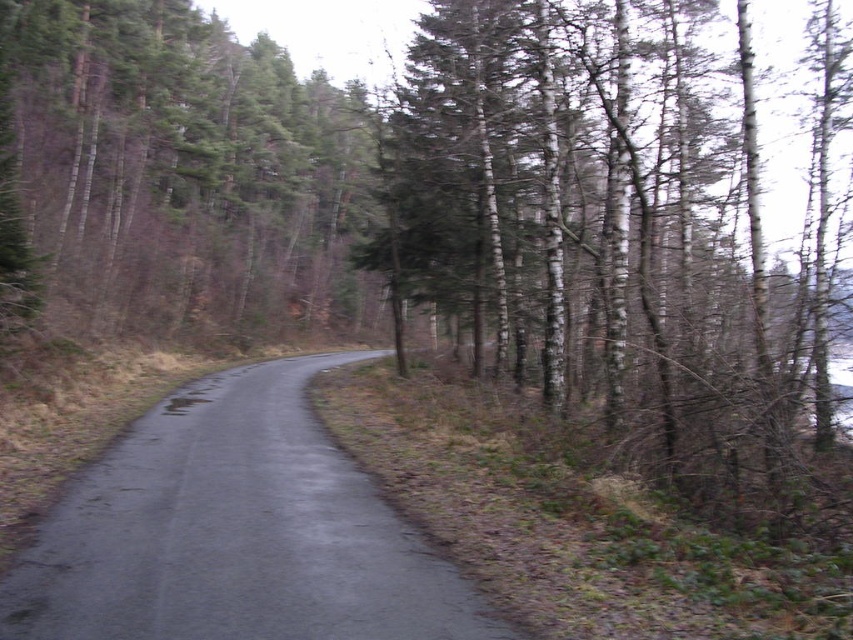
Question: Is smooth white bark trees at right below green textured pine trees at upper left?

Choices:
 (A) yes
 (B) no

Answer: (A)

Question: In this image, where is green textured pine trees at upper left located relative to black asphalt road at center?

Choices:
 (A) left
 (B) right

Answer: (A)

Question: Which of the following is the farthest from the observer?

Choices:
 (A) green textured pine trees at upper left
 (B) smooth white bark trees at right
 (C) black asphalt road at center

Answer: (A)

Question: Among these objects, which one is nearest to the camera?

Choices:
 (A) green textured pine trees at upper left
 (B) black asphalt road at center

Answer: (B)

Question: Among these objects, which one is nearest to the camera?

Choices:
 (A) green textured pine trees at upper left
 (B) black asphalt road at center
 (C) smooth white bark trees at right

Answer: (B)

Question: Does smooth white bark trees at right have a greater width compared to green textured pine trees at upper left?

Choices:
 (A) no
 (B) yes

Answer: (B)